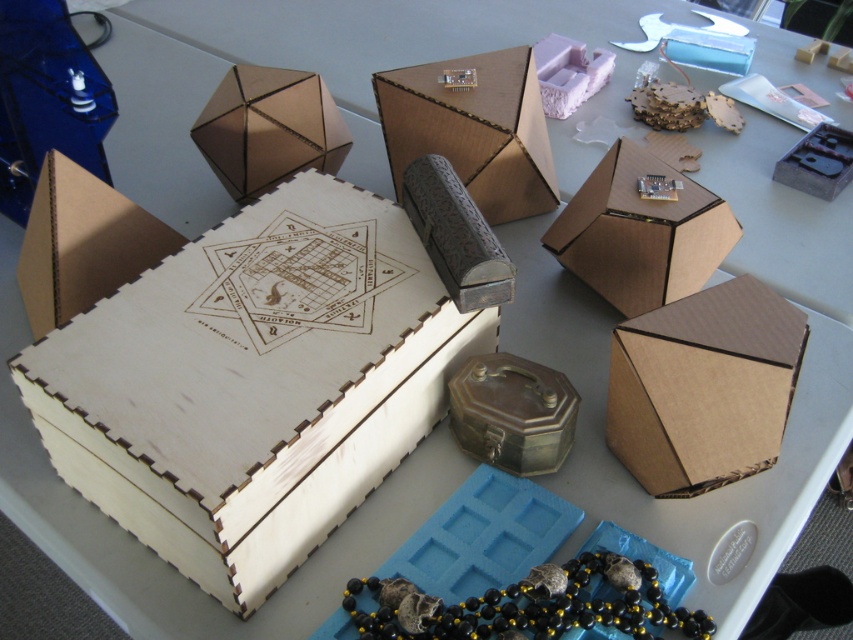
You are standing at the point indicated by the coordinates point (473, 129) in the image. What object are you directly facing?

The point (473, 129) indicates the matte cardboard box at center, so you are directly facing the matte cardboard box at center.

You are standing at a distance from the arrangement of boxes and want to reach the point labeled as point (329, 417). If your arm can extend 28 inches, can you comfortably reach that point without moving closer?

The distance between you and point (329, 417) is 29.08 inches, which is slightly beyond your arm extension of 28 inches. You would need to move closer to comfortably reach it.